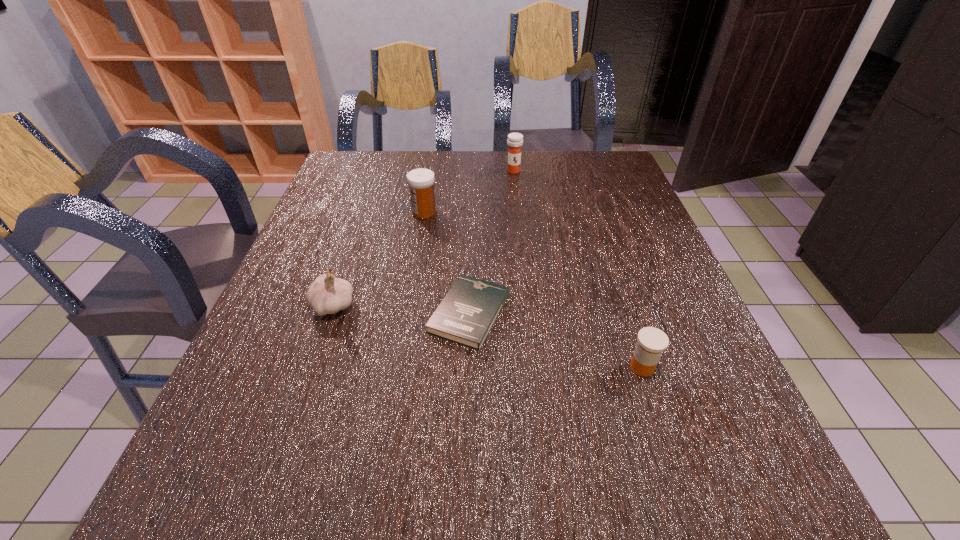
Find the location of a particular element. vacant space at the near edge of the desktop is located at coordinates (385, 471).

This screenshot has width=960, height=540. Identify the location of free space at the left edge of the desktop. (210, 441).

This screenshot has height=540, width=960. Find the location of `vacant space at the right edge of the desktop`. vacant space at the right edge of the desktop is located at coordinates (723, 392).

Identify the location of vacant region at the far left corner. This screenshot has height=540, width=960. (382, 188).

In the image, there is a desktop. At what (x,y) coordinates should I click in order to perform the action: click on vacant space at the near left corner. Please return your answer as a coordinate pair (x, y). This screenshot has width=960, height=540. Looking at the image, I should click on (275, 472).

In the image, there is a desktop. At what (x,y) coordinates should I click in order to perform the action: click on vacant space at the far right corner. Please return your answer as a coordinate pair (x, y). Looking at the image, I should click on (608, 152).

The width and height of the screenshot is (960, 540). Identify the location of vacant area that lies between the second medicine from right to left and the third object from left to right. (492, 242).

I want to click on vacant space in between the farthest object and the leftmost object, so click(x=423, y=238).

Image resolution: width=960 pixels, height=540 pixels. I want to click on blank region between the third object from left to right and the rightmost object, so click(556, 340).

Where is `free spot between the shortest object and the garlic`? The width and height of the screenshot is (960, 540). free spot between the shortest object and the garlic is located at coordinates (401, 309).